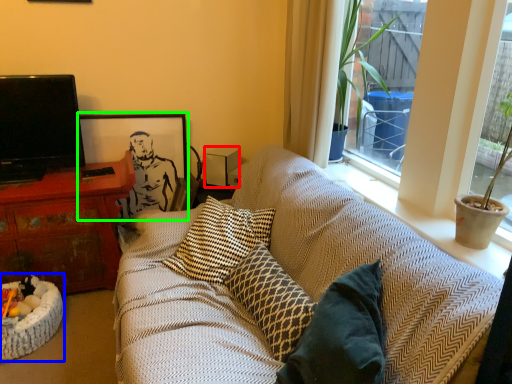
Question: Estimate the real-world distances between objects in this image. Which object is farther from loudspeaker (highlighted by a red box), cat bed (highlighted by a blue box) or picture frame (highlighted by a green box)?

Choices:
 (A) cat bed
 (B) picture frame

Answer: (A)